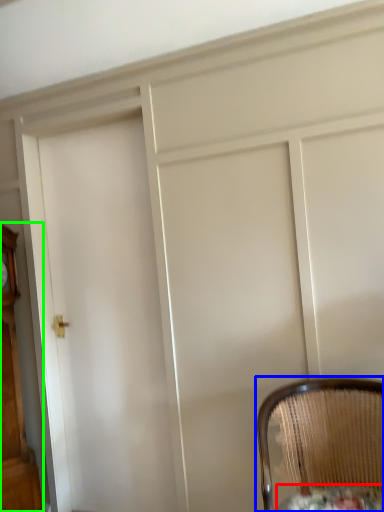
Question: Based on their relative distances, which object is nearer to round table (highlighted by a red box)? Choose from chair (highlighted by a blue box) and furniture (highlighted by a green box).

Choices:
 (A) chair
 (B) furniture

Answer: (A)